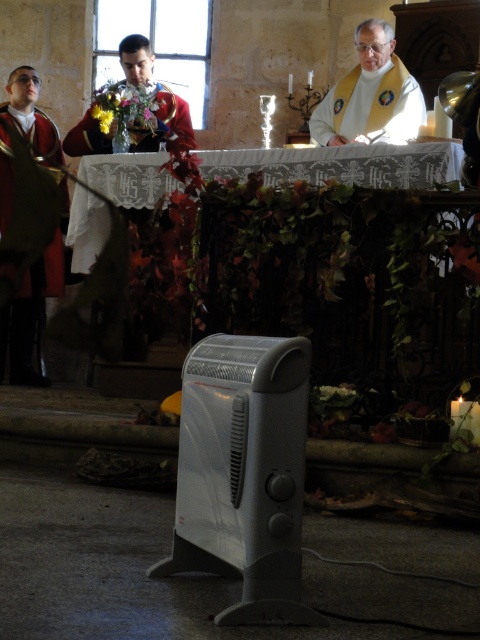
Consider the image. You are standing at the entrance of the church and want to reach the matte green robe at left. The church has a 6 meter long corridor. Can you reach the robe without needing to go through any doors?

The matte green robe at left is 5.97 meters away from camera, so yes, you can reach it without needing to go through any doors since the distance is within the 6 meter long corridor.

You are standing in the church scene described. There is a point marked at coordinates (x=371, y=93). What object is located at this point?

The point at coordinates (x=371, y=93) marks the white glossy vest at upper center.

You are a photographer positioned at the entrance of the church. You need to take a photo of the white glossy vest at upper center. According to the scene description, where should you aim your camera to capture the vest in the frame?

The white glossy vest at upper center is located at point 0.148 on the x axis and 0.773 on the y axis. To capture it, aim your camera towards that coordinate.